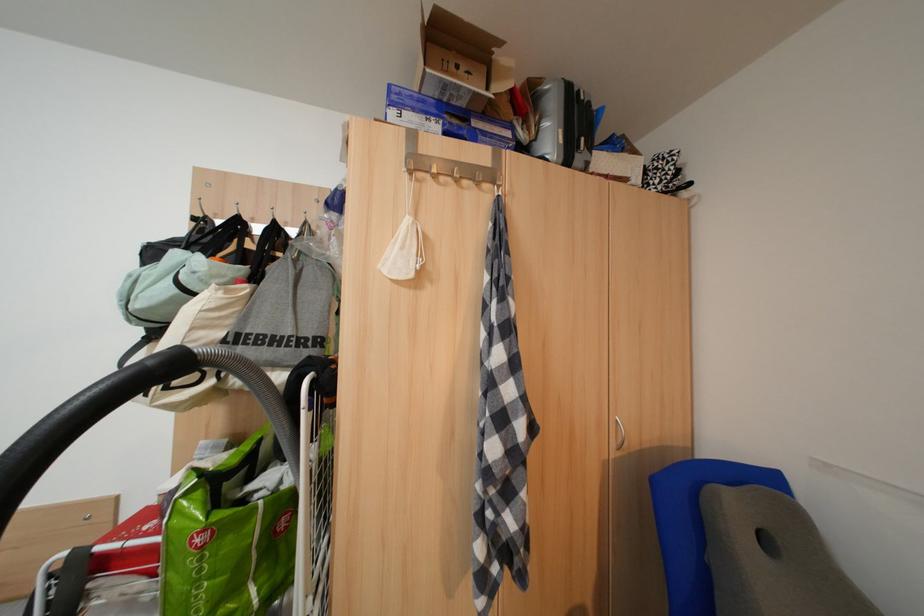
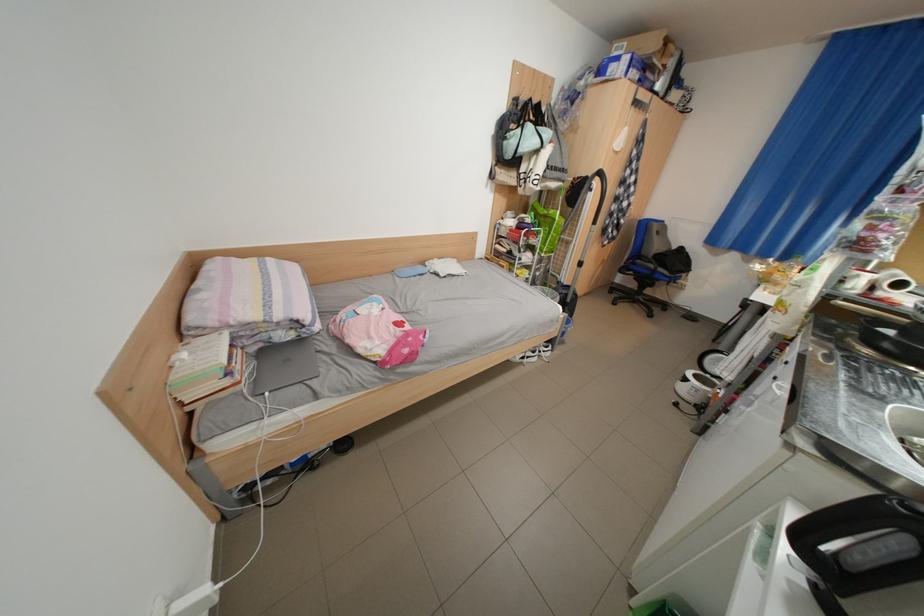
Question: I am providing you with two images of the same scene from different viewpoints. After the viewpoint changes to image2, which objects are now occluded?

Choices:
 (A) wardrobe door handle
 (B) black frying pan
 (C) chair sitting surface
 (D) none of these

Answer: (D)